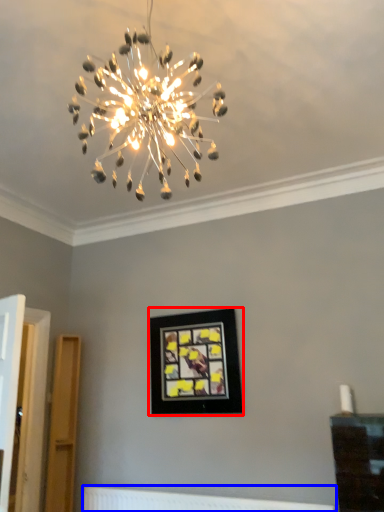
Question: Which point is closer to the camera, picture frame (highlighted by a red box) or radiator (highlighted by a blue box)?

Choices:
 (A) picture frame
 (B) radiator

Answer: (B)